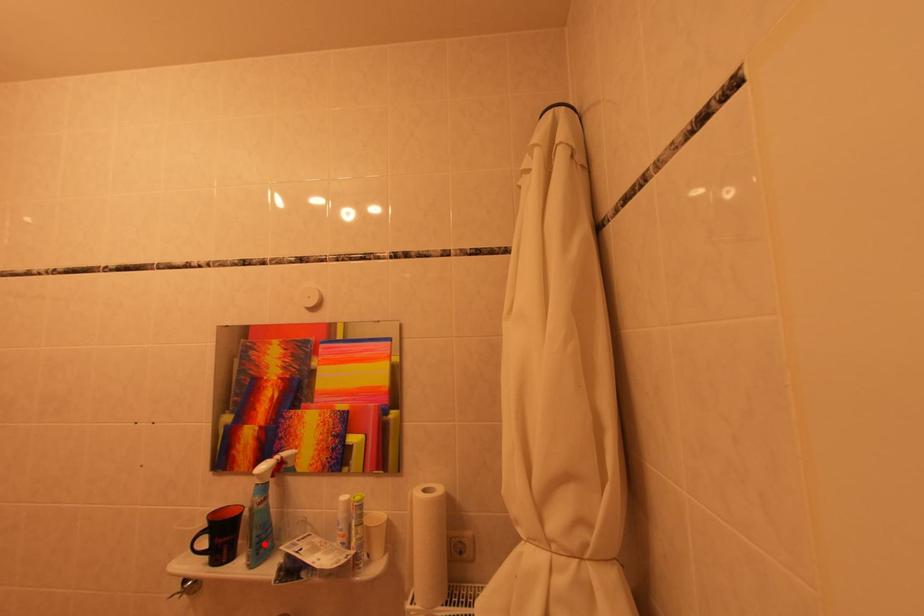
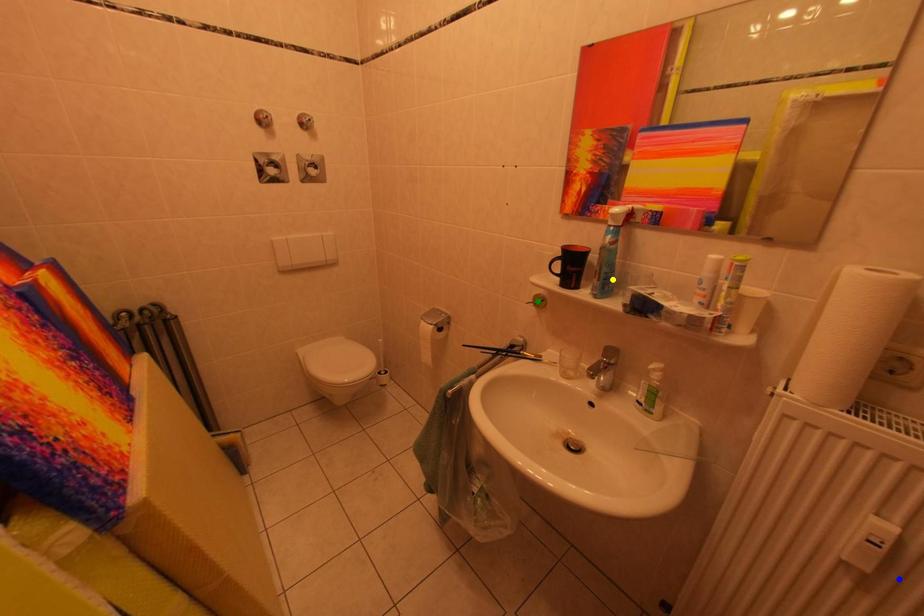
Question: I am providing you with two images of the same scene from different viewpoints. A red point is marked on the first image. You are given multiple points on the second image. Can you choose the point in image 2 that corresponds to the point in image 1?

Choices:
 (A) blue point
 (B) green point
 (C) yellow point

Answer: (C)